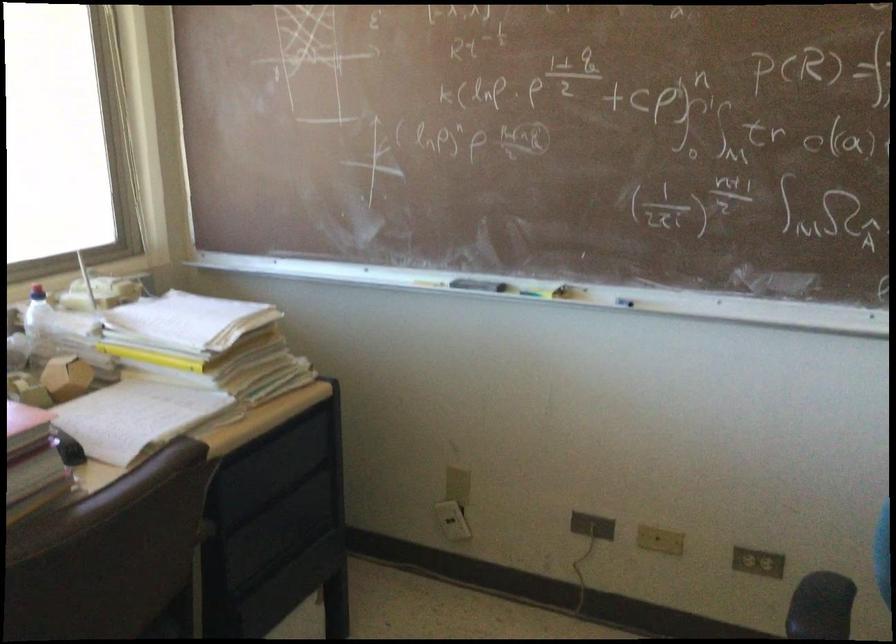
Find where to pull the white electrical plug. Please return your answer as a coordinate pair (x, y).

(452, 520)